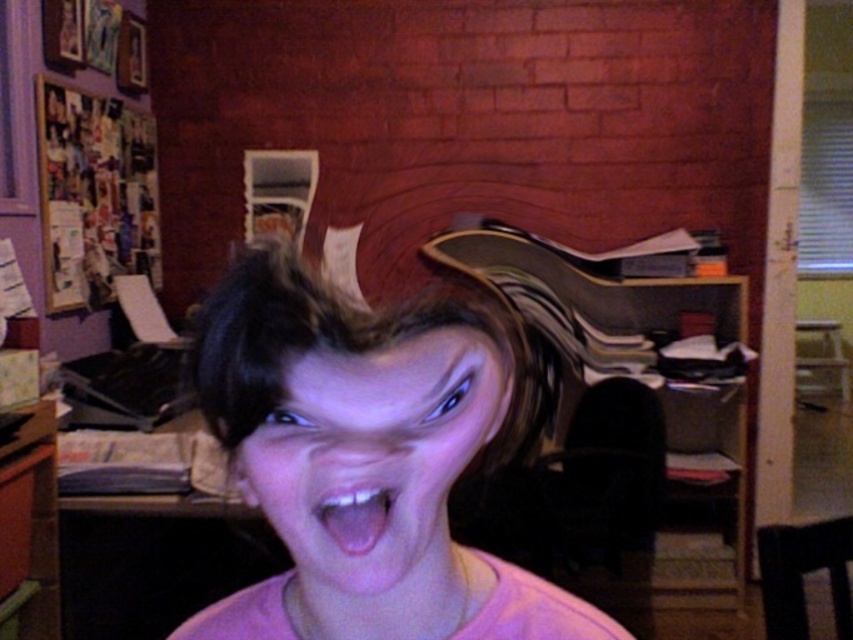
You are a makeup artist observing a person in the scene. You notice the pink matte face at center and the pink glossy tongue at center. Which object is located higher in the image?

The pink glossy tongue at center is higher because the pink matte face at center is positioned under it.

Consider the image. You are looking at the image and notice two points marked in the scene. Which of the two points, point (354, 481) or point (389, 509), is closer to you?

Point (354, 481) is closer to the viewer than point (389, 509).

You are standing in front of the desk in the image. Where is the pink matte hair at center located relative to the brick wall?

The pink matte hair at center is located at point [370,454] relative to the brick wall.